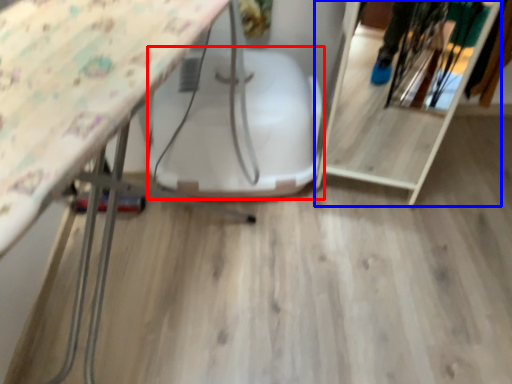
Question: Which point is further to the camera, swivel chair (highlighted by a red box) or shelf (highlighted by a blue box)?

Choices:
 (A) swivel chair
 (B) shelf

Answer: (A)